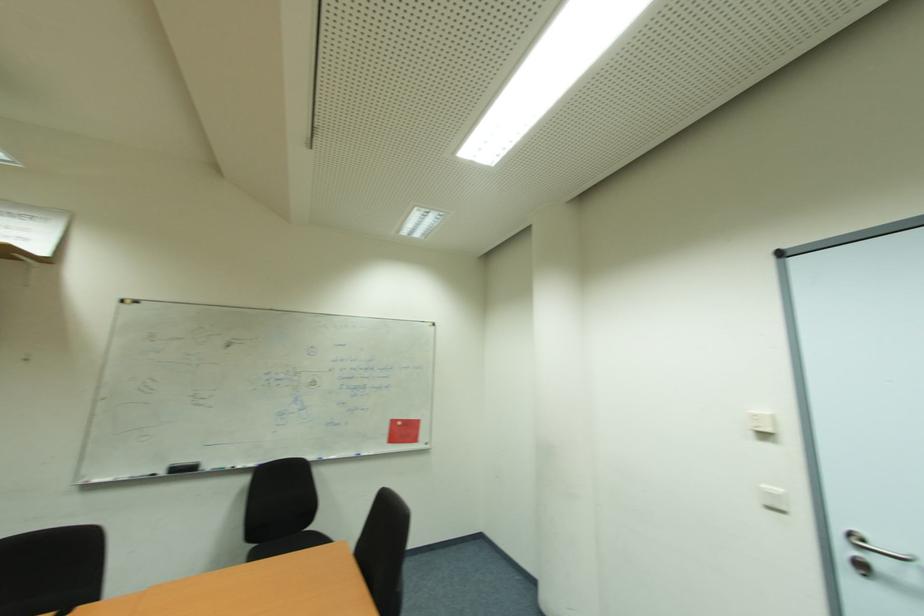
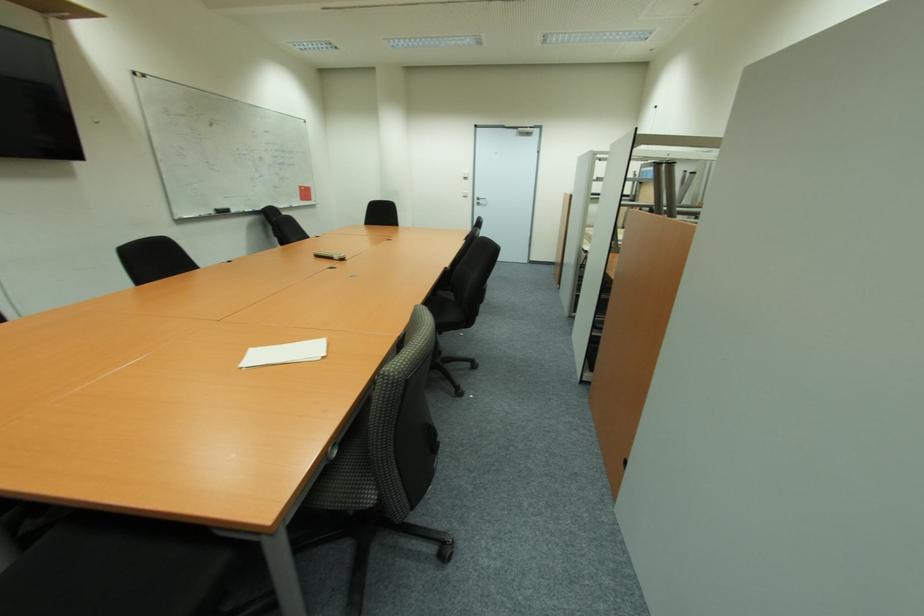
Find the pixel in the second image that matches point (883, 564) in the first image.

(483, 203)